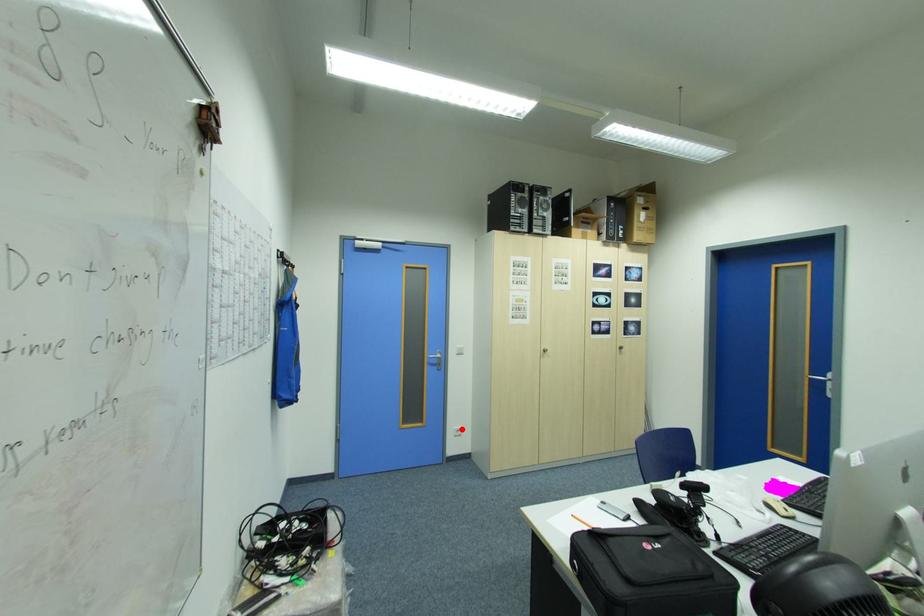
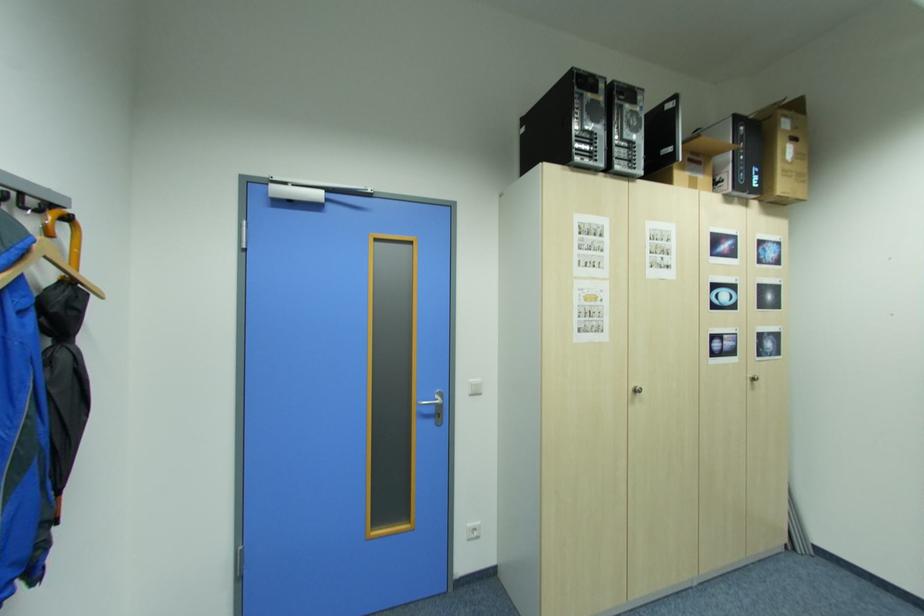
In the second image, find the point that corresponds to the highlighted location in the first image.

(476, 529)